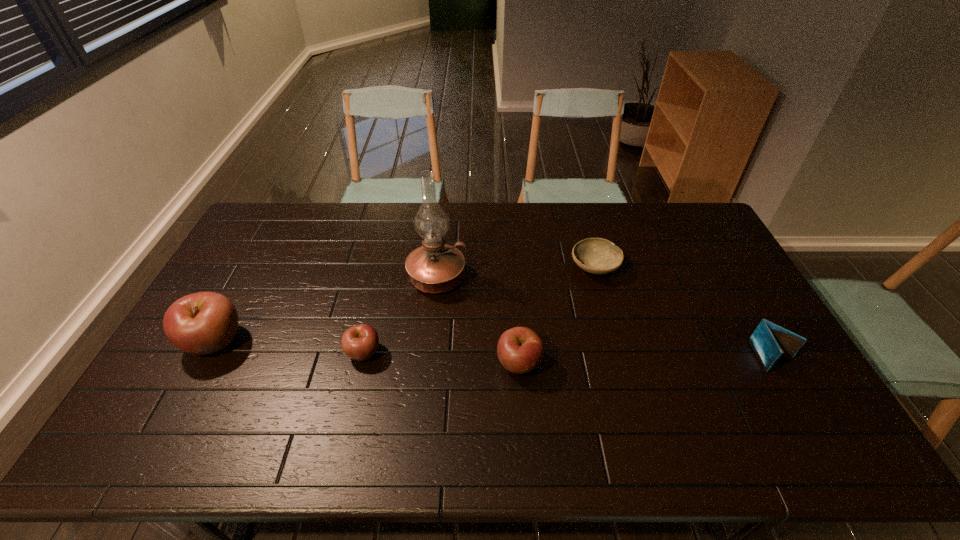
Locate an element on the screen. Image resolution: width=960 pixels, height=540 pixels. vacant space at the right edge of the desktop is located at coordinates (737, 272).

Where is `free spot between the tallest apple and the oil lamp`? The width and height of the screenshot is (960, 540). free spot between the tallest apple and the oil lamp is located at coordinates (326, 310).

Where is `vacant space in between the rightmost object and the bowl`? Image resolution: width=960 pixels, height=540 pixels. vacant space in between the rightmost object and the bowl is located at coordinates (684, 312).

You are a GUI agent. You are given a task and a screenshot of the screen. Output one action in this format:
    pyautogui.click(x=<x>, y=<y>)
    Task: Click on the vacant area that lies between the fourth object from left to right and the fifth object from left to right
    This screenshot has height=540, width=960.
    Given the screenshot: What is the action you would take?
    (x=557, y=315)

You are a GUI agent. You are given a task and a screenshot of the screen. Output one action in this format:
    pyautogui.click(x=<x>, y=<y>)
    Task: Click on the vacant region between the rightmost apple and the tallest object
    
    Given the screenshot: What is the action you would take?
    pyautogui.click(x=478, y=321)

Locate an element on the screen. empty space between the shortest apple and the tallest apple is located at coordinates click(x=289, y=347).

At what (x,y) coordinates should I click in order to perform the action: click on free spot between the rightmost object and the second shortest apple. Please return your answer as a coordinate pair (x, y). This screenshot has height=540, width=960. Looking at the image, I should click on (646, 360).

Locate an element on the screen. Image resolution: width=960 pixels, height=540 pixels. vacant area that lies between the tallest apple and the oil lamp is located at coordinates (326, 310).

This screenshot has width=960, height=540. I want to click on vacant space that's between the tallest object and the second tallest object, so click(x=326, y=310).

Locate an element on the screen. The width and height of the screenshot is (960, 540). unoccupied position between the oil lamp and the rightmost object is located at coordinates (605, 318).